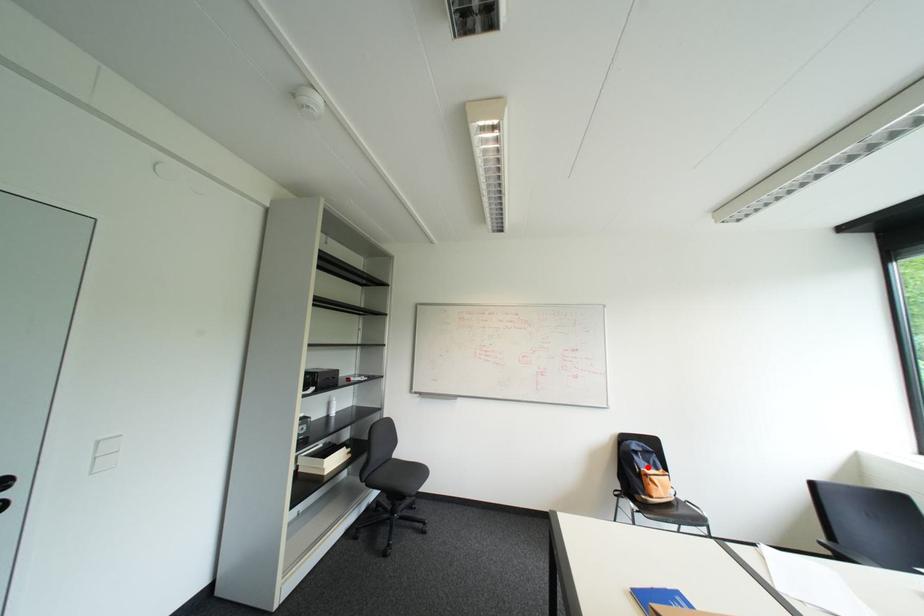
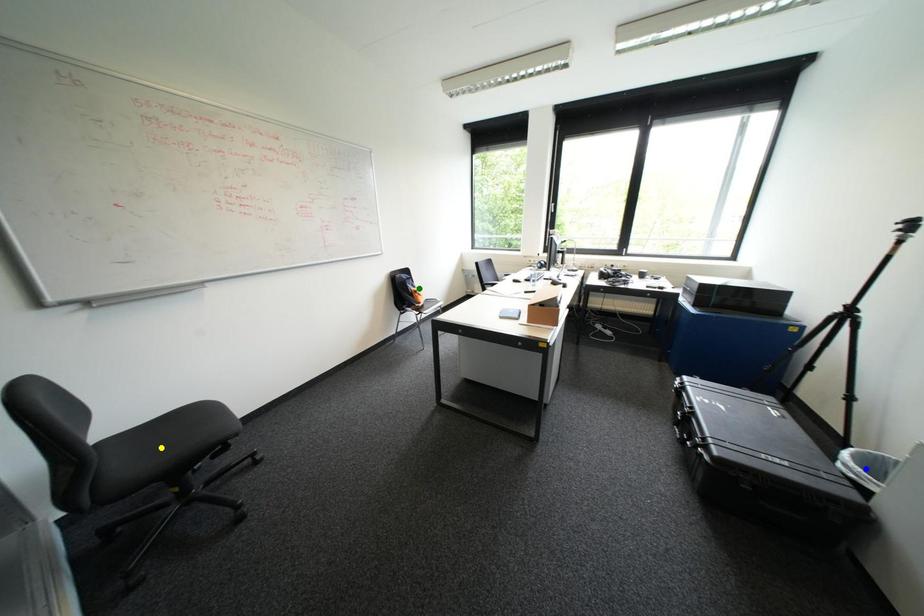
Question: I am providing you with two images of the same scene from different viewpoints. A red point is marked on the first image. You are given multiple points on the second image. In image 2, which mark is for the same physical point as the one in image 1?

Choices:
 (A) green point
 (B) blue point
 (C) yellow point

Answer: (A)